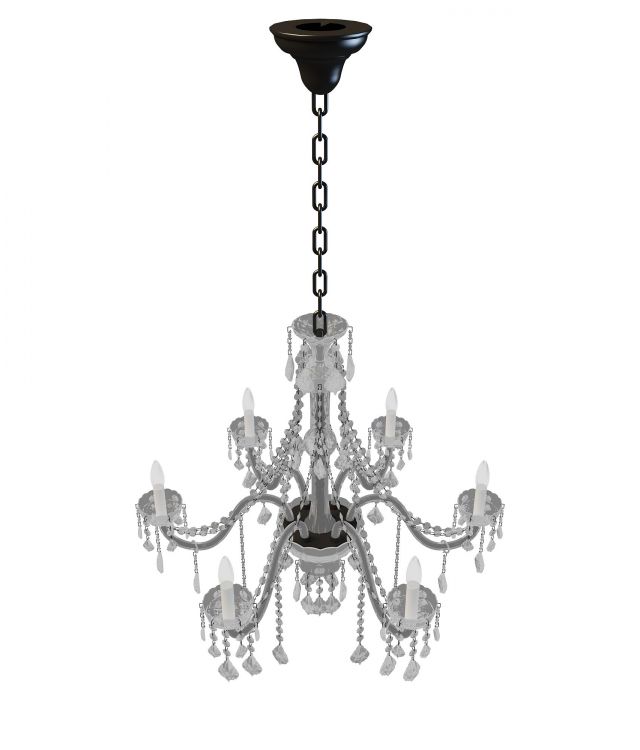
Find where you'd mount the chandelier in the image. Your answer should be formatted as a list of tuples, i.e. [(x1, y1), (x2, y2), ...], where each tuple contains the x and y coordinates of a point satisfying the conditions above.

[(322, 40)]